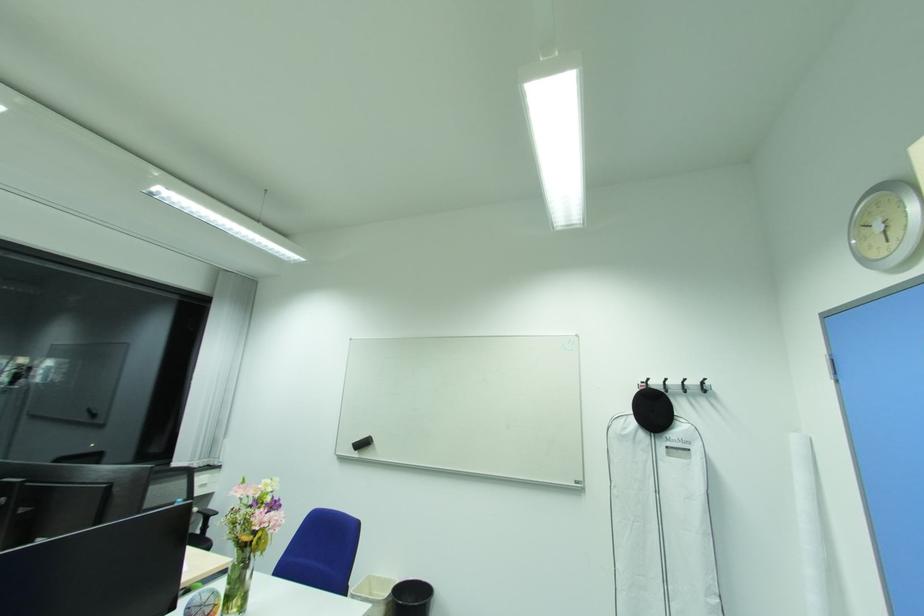
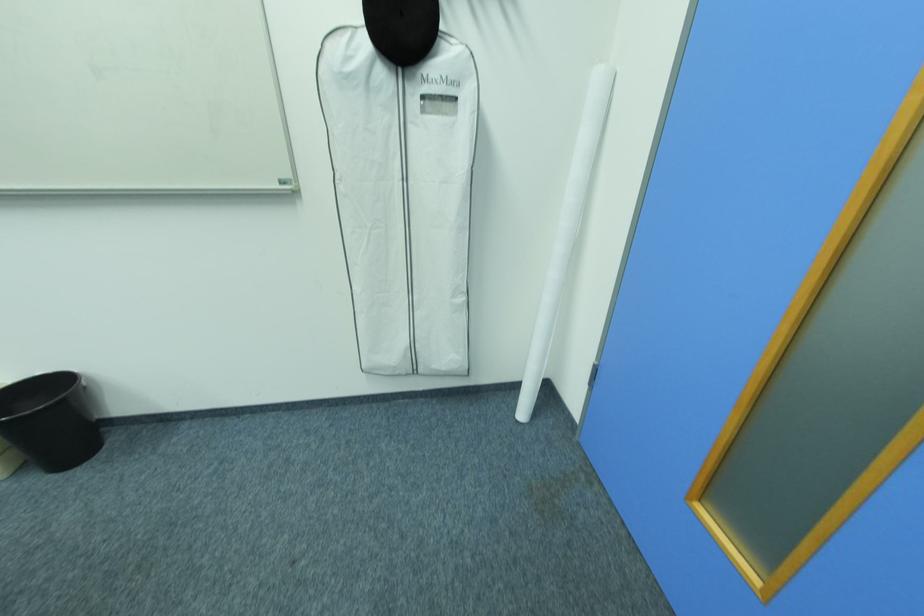
In the second image, find the point that corresponds to the point at 671,581 in the first image.

(416, 292)